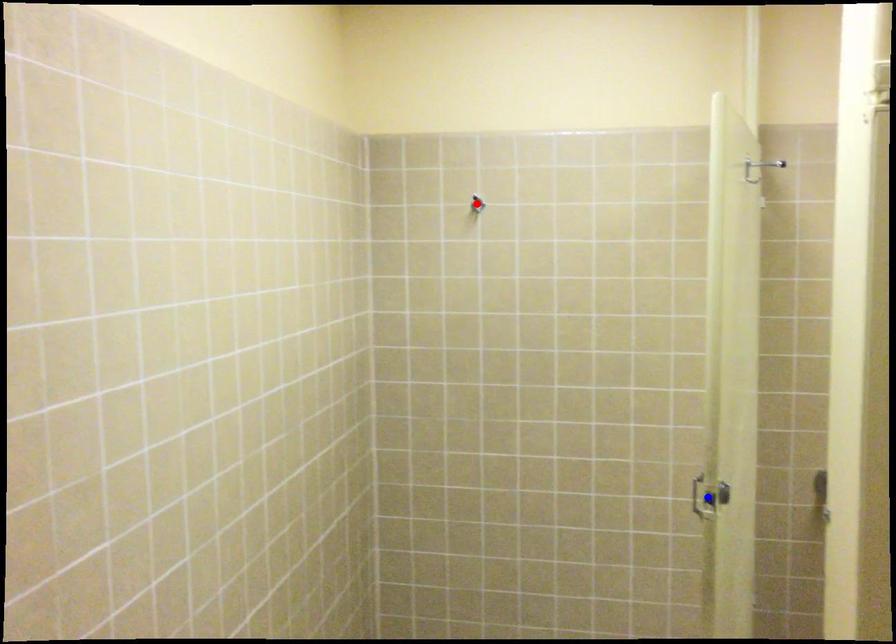
Question: Which of the two points in the image is closer to the camera?

Choices:
 (A) Blue point is closer.
 (B) Red point is closer.

Answer: (A)